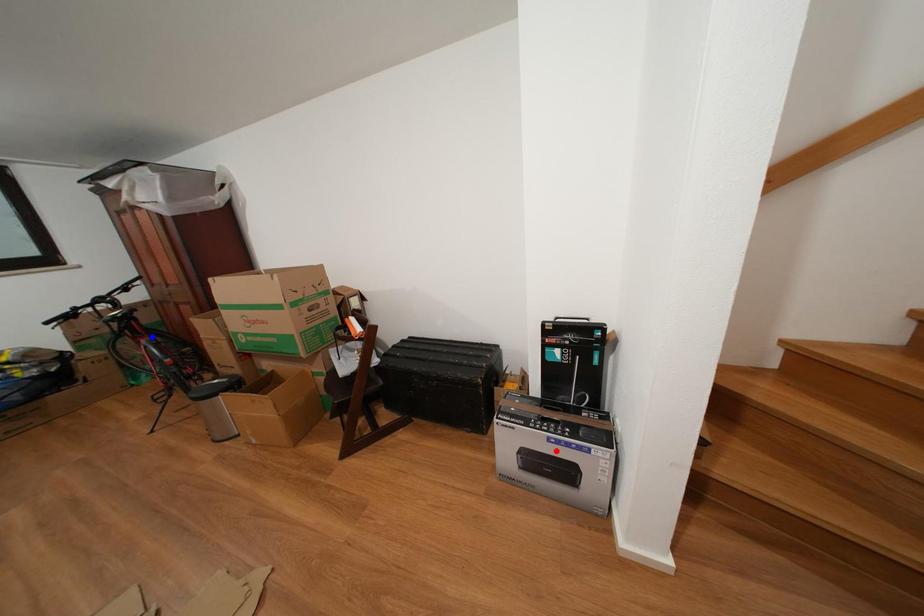
Question: Which of the two points in the image is closer to the camera?

Choices:
 (A) Blue point is closer.
 (B) Red point is closer.

Answer: (B)